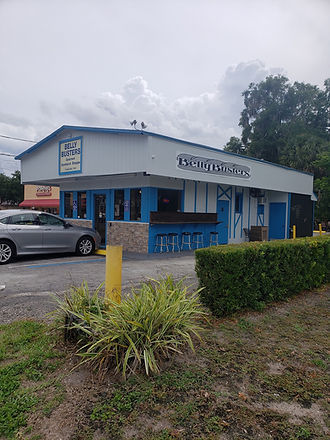
Locate an element on the screen. chair is located at coordinates (249, 235).